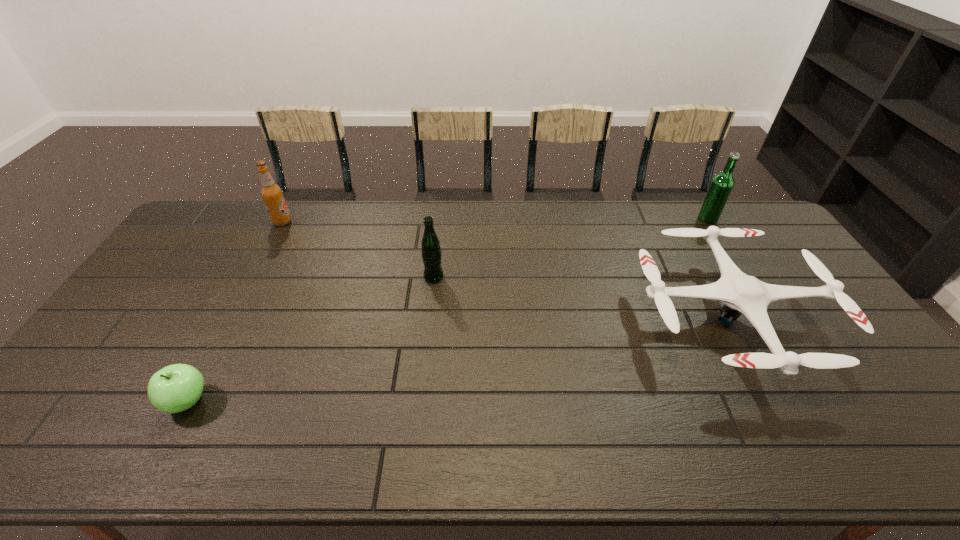
Locate an element on the screen. Image resolution: width=960 pixels, height=540 pixels. beer bottle that is the third closest to the shortest object is located at coordinates click(x=722, y=184).

Locate an element on the screen. The width and height of the screenshot is (960, 540). vacant point that satisfies the following two spatial constraints: 1. on the front label of the nearest beer bottle; 2. on the right side of the leftmost beer bottle is located at coordinates (253, 277).

Where is `free space that satisfies the following two spatial constraints: 1. on the front label of the leftmost beer bottle; 2. on the right side of the nearest beer bottle`? The height and width of the screenshot is (540, 960). free space that satisfies the following two spatial constraints: 1. on the front label of the leftmost beer bottle; 2. on the right side of the nearest beer bottle is located at coordinates [253, 277].